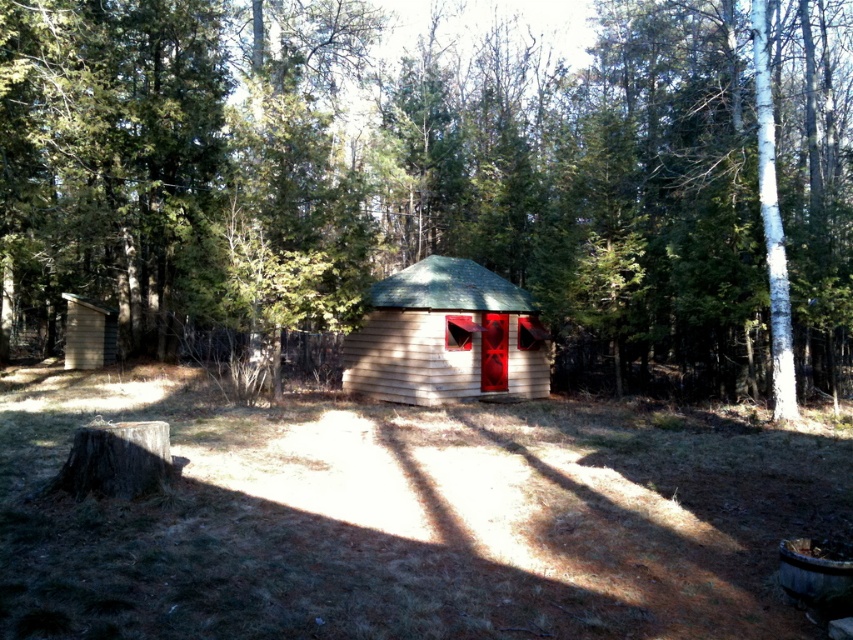
Question: Which of the following is the farthest from the observer?

Choices:
 (A) (398, 401)
 (B) (20, 308)

Answer: (B)

Question: Is brown wood tree at center to the right of light brown wooden log cabin at center from the viewer's perspective?

Choices:
 (A) yes
 (B) no

Answer: (B)

Question: Which of the following is the farthest from the observer?

Choices:
 (A) (511, 332)
 (B) (804, 77)

Answer: (B)

Question: Among these points, which one is farthest from the camera?

Choices:
 (A) (289, 17)
 (B) (437, 403)

Answer: (A)

Question: Is the position of brown wood tree at center more distant than that of light brown wooden log cabin at center?

Choices:
 (A) no
 (B) yes

Answer: (A)

Question: Is brown wood tree at center smaller than light brown wooden log cabin at center?

Choices:
 (A) yes
 (B) no

Answer: (B)